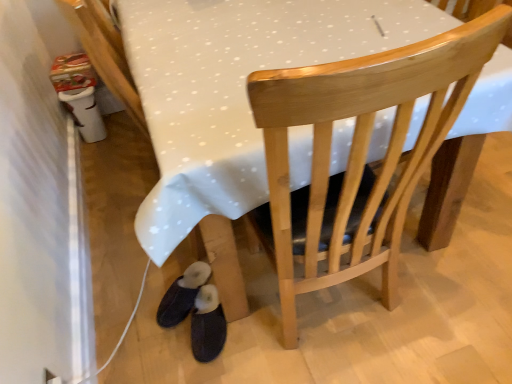
At what (x,y) coordinates should I click in order to perform the action: click on blank space to the left of wooden chair at center. Please return your answer as a coordinate pair (x, y). Looking at the image, I should click on (192, 338).